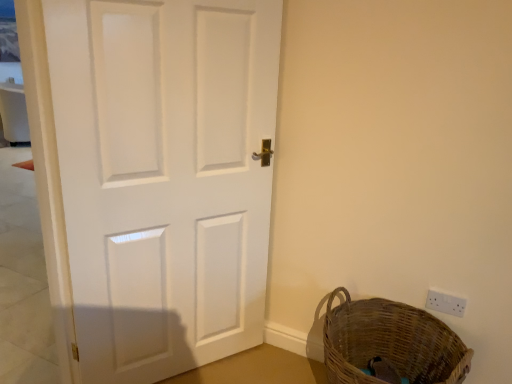
Question: Can you confirm if white matte door at center is wider than white plastic electric outlet at lower right?

Choices:
 (A) yes
 (B) no

Answer: (A)

Question: Is there a large distance between white matte door at center and white plastic electric outlet at lower right?

Choices:
 (A) no
 (B) yes

Answer: (B)

Question: Is white matte door at center with white plastic electric outlet at lower right?

Choices:
 (A) no
 (B) yes

Answer: (A)

Question: Is white matte door at center at the right side of white plastic electric outlet at lower right?

Choices:
 (A) yes
 (B) no

Answer: (B)

Question: Can we say white matte door at center lies outside white plastic electric outlet at lower right?

Choices:
 (A) yes
 (B) no

Answer: (A)

Question: Based on their sizes in the image, would you say white plastic electric outlet at lower right is bigger or smaller than white matte door at center?

Choices:
 (A) small
 (B) big

Answer: (A)

Question: Relative to white matte door at center, is white plastic electric outlet at lower right in front or behind?

Choices:
 (A) front
 (B) behind

Answer: (B)

Question: From a real-world perspective, is white plastic electric outlet at lower right positioned above or below white matte door at center?

Choices:
 (A) below
 (B) above

Answer: (A)

Question: From the image's perspective, is white plastic electric outlet at lower right positioned above or below white matte door at center?

Choices:
 (A) above
 (B) below

Answer: (B)

Question: Considering the positions of woven brown basket at lower right and white matte door at center in the image, is woven brown basket at lower right bigger or smaller than white matte door at center?

Choices:
 (A) small
 (B) big

Answer: (A)

Question: In the image, is woven brown basket at lower right positioned in front of or behind white matte door at center?

Choices:
 (A) front
 (B) behind

Answer: (B)

Question: Would you say woven brown basket at lower right is inside or outside white matte door at center?

Choices:
 (A) outside
 (B) inside

Answer: (A)

Question: From the image's perspective, is woven brown basket at lower right above or below white matte door at center?

Choices:
 (A) above
 (B) below

Answer: (B)

Question: Visually, is white plastic electric outlet at lower right positioned to the left or to the right of woven brown basket at lower right?

Choices:
 (A) left
 (B) right

Answer: (B)

Question: From a real-world perspective, relative to woven brown basket at lower right, is white plastic electric outlet at lower right vertically above or below?

Choices:
 (A) below
 (B) above

Answer: (B)